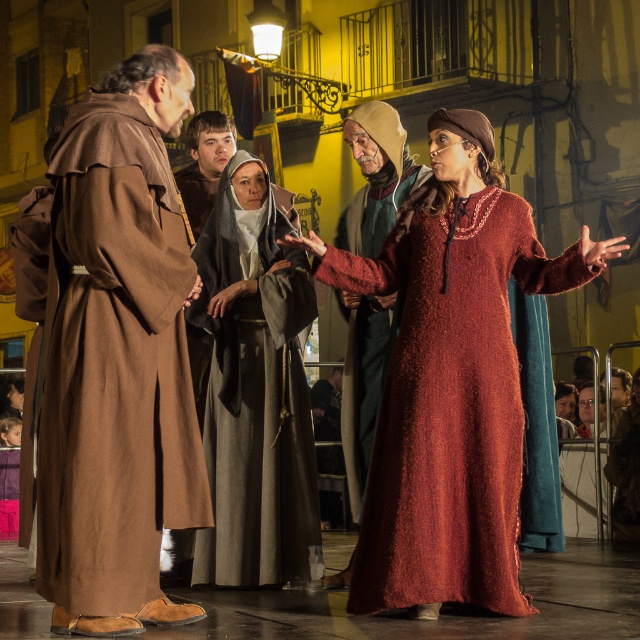
Question: Is brown woolen robe at left above velvet-like red dress at center?

Choices:
 (A) yes
 (B) no

Answer: (A)

Question: Based on their relative distances, which object is farther from the knitted wool dress at center?

Choices:
 (A) brown woolen robe at center
 (B) brown woolen robe at left

Answer: (A)

Question: Is knitted wool dress at center thinner than brown woolen robe at center?

Choices:
 (A) yes
 (B) no

Answer: (B)

Question: Which of the following is the closest to the observer?

Choices:
 (A) (282, 420)
 (B) (356, 468)
 (C) (61, 161)
 (D) (515, 465)

Answer: (C)

Question: Does knitted wool dress at center appear over brown woolen robe at center?

Choices:
 (A) yes
 (B) no

Answer: (A)

Question: Which point is closer to the camera?

Choices:
 (A) (508, 600)
 (B) (54, 276)
 (C) (296, 266)
 (D) (371, 349)

Answer: (B)